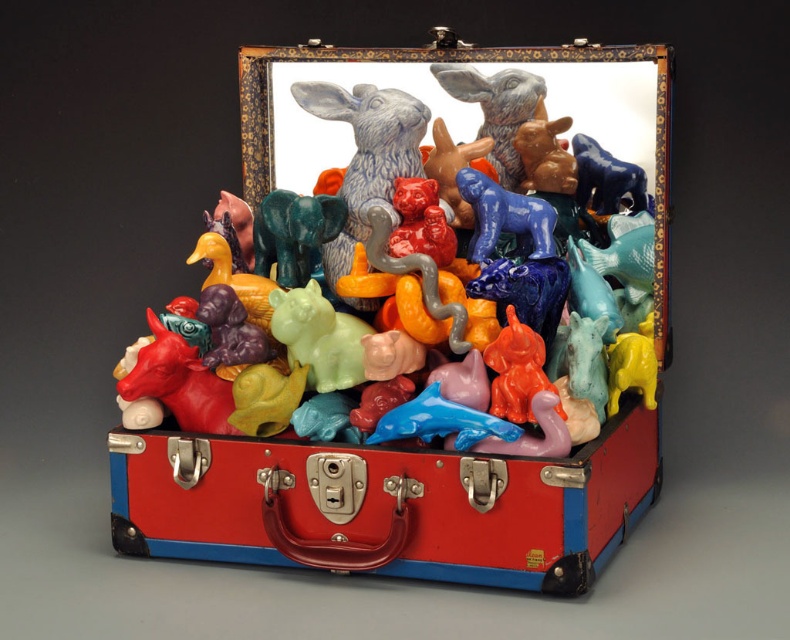
Can you confirm if teal glossy elephant at center is wider than blue glossy dog at center?

Indeed, teal glossy elephant at center has a greater width compared to blue glossy dog at center.

Is teal glossy elephant at center to the left of blue glossy dog at center from the viewer's perspective?

Correct, you'll find teal glossy elephant at center to the left of blue glossy dog at center.

The height and width of the screenshot is (640, 790). In order to click on teal glossy elephant at center in this screenshot , I will do `click(294, 234)`.

Image resolution: width=790 pixels, height=640 pixels. Identify the location of teal glossy elephant at center. (294, 234).

Does matte plastic animals at center come behind blue glossy dog at center?

No, matte plastic animals at center is closer to the viewer.

Who is higher up, matte plastic animals at center or blue glossy dog at center?

blue glossy dog at center is higher up.

Identify the location of matte plastic animals at center. This screenshot has height=640, width=790. (409, 336).

What are the coordinates of `matte plastic animals at center` in the screenshot? It's located at coord(409,336).

Can you confirm if teal glossy elephant at center is bigger than blue glossy horse at upper center?

Correct, teal glossy elephant at center is larger in size than blue glossy horse at upper center.

Can you confirm if teal glossy elephant at center is positioned to the right of blue glossy horse at upper center?

Incorrect, teal glossy elephant at center is not on the right side of blue glossy horse at upper center.

Where is `teal glossy elephant at center`? teal glossy elephant at center is located at coordinates (294, 234).

Locate an element on the screen. The image size is (790, 640). teal glossy elephant at center is located at coordinates (294, 234).